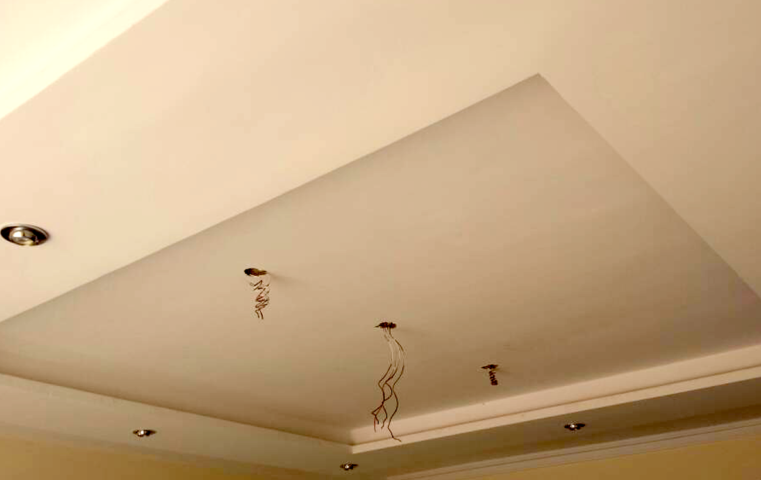
Find the location of `yellow wall left`. yellow wall left is located at coordinates (78, 463).